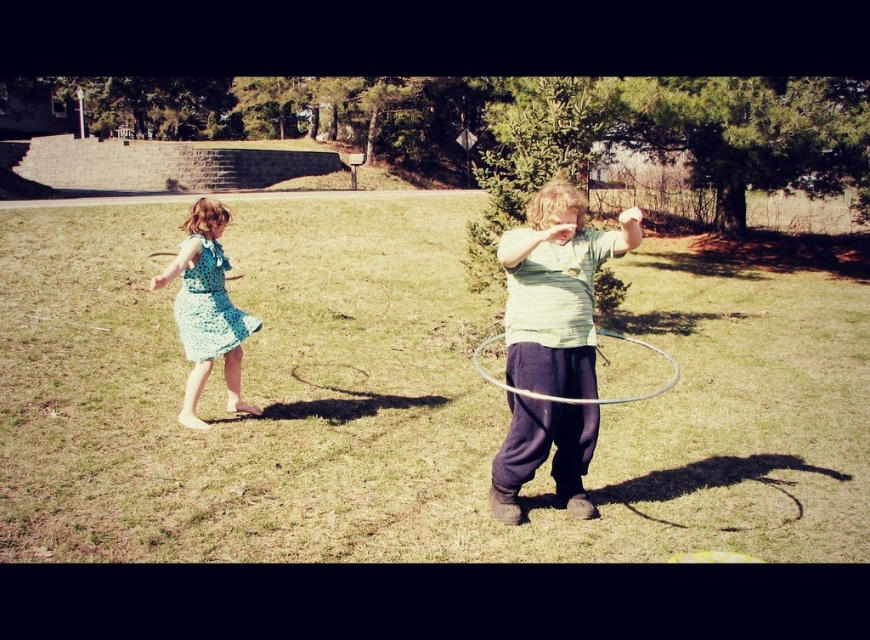
Is green dotted dress at left above silver metallic hula hoop at center?

Yes, green dotted dress at left is above silver metallic hula hoop at center.

Identify the location of green dotted dress at left. (206, 308).

Who is more distant from viewer, (784,323) or (185,292)?

Positioned behind is point (784,323).

Can you confirm if clear plastic hula hoop at center is wider than green dotted dress at left?

Correct, the width of clear plastic hula hoop at center exceeds that of green dotted dress at left.

Locate an element on the screen. This screenshot has height=640, width=870. clear plastic hula hoop at center is located at coordinates (405, 401).

Can you confirm if light green fabric shirt at center is taller than silver metallic hula hoop at center?

Correct, light green fabric shirt at center is much taller as silver metallic hula hoop at center.

Between light green fabric shirt at center and silver metallic hula hoop at center, which one has more height?

Standing taller between the two is light green fabric shirt at center.

Identify the location of light green fabric shirt at center. This screenshot has width=870, height=640. (556, 291).